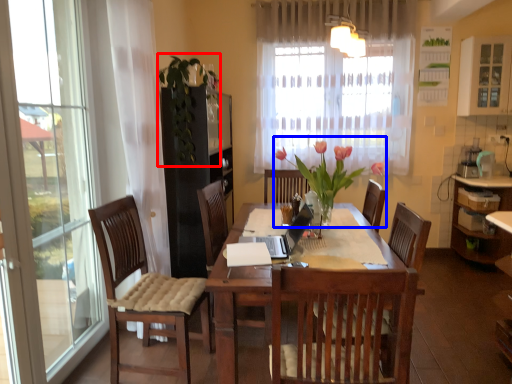
Question: Among these objects, which one is nearest to the camera, floral arrangement (highlighted by a red box) or floral arrangement (highlighted by a blue box)?

Choices:
 (A) floral arrangement
 (B) floral arrangement

Answer: (B)